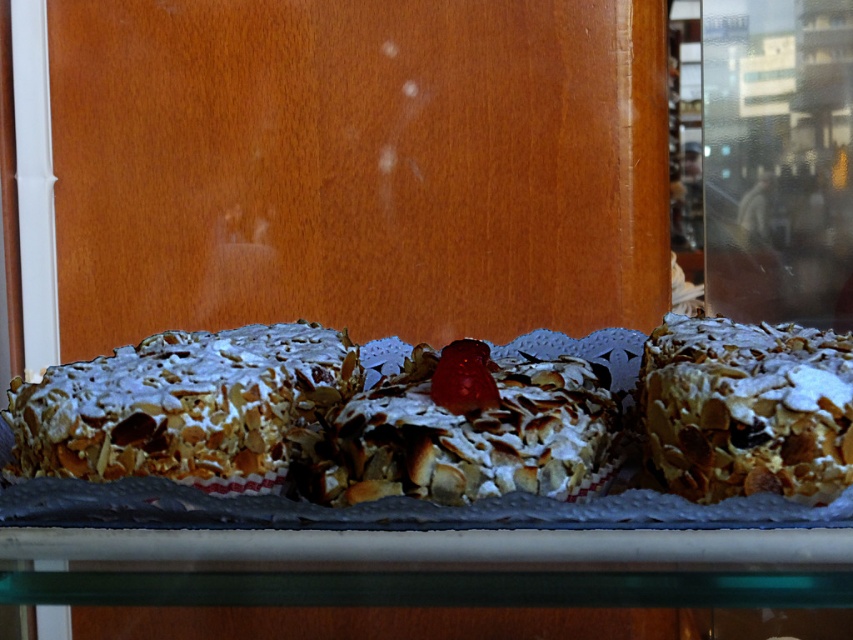
You are a customer in a bakery and want to pick up the powdered almond cake at left and the powdered almond cake at center. Which one do you need to move first to avoid blocking the other?

You should move the powdered almond cake at left first because it is located below the powdered almond cake at center, so moving it first will prevent blocking access to the one above.

You are a customer looking at the display case. You see two points inside the case labeled as point (245, 456) and point (329, 497). Which point is closer to you?

Point (245, 456) is further to the camera than point (329, 497), so the point closer to you is point (329, 497).